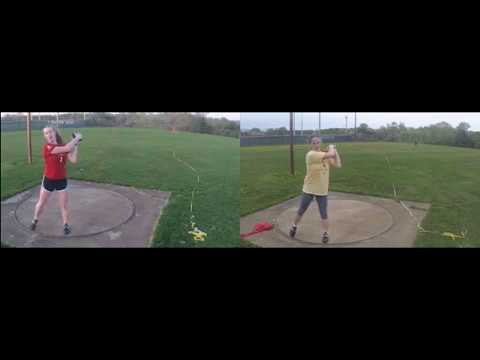
The width and height of the screenshot is (480, 360). Find the location of `red cloth on the ground`. red cloth on the ground is located at coordinates (267, 227).